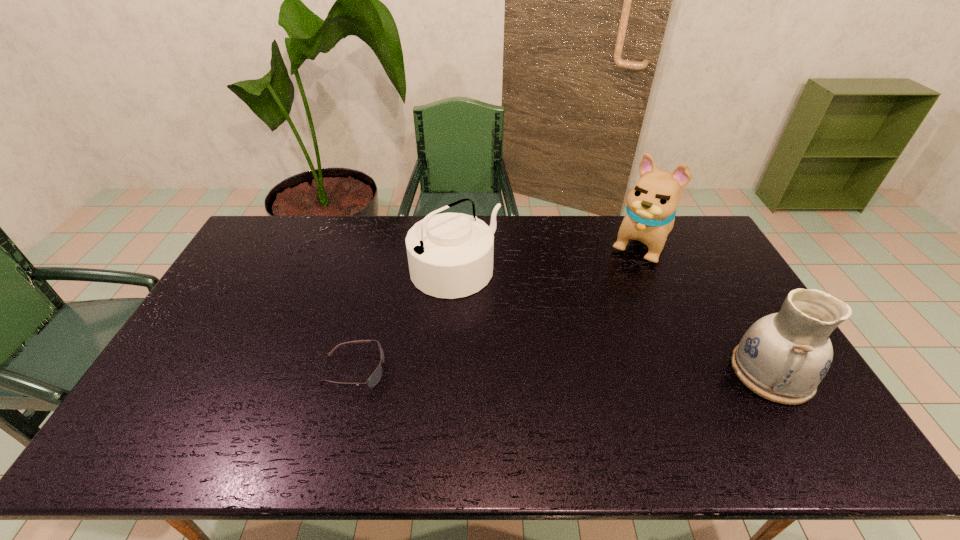
Locate an element on the screen. object that is at the near right corner is located at coordinates (782, 357).

The width and height of the screenshot is (960, 540). In the image, there is a desktop. What are the coordinates of `vacant space at the far edge` in the screenshot? It's located at (605, 230).

Find the location of a particular element. The height and width of the screenshot is (540, 960). free point at the left edge is located at coordinates (205, 306).

The image size is (960, 540). Identify the location of vacant space at the right edge. (685, 255).

Identify the location of free space at the far left corner of the desktop. This screenshot has height=540, width=960. (298, 228).

Where is `vacant space at the near right corner`? This screenshot has width=960, height=540. vacant space at the near right corner is located at coordinates (806, 410).

This screenshot has width=960, height=540. I want to click on vacant space that's between the tallest object and the kettle, so click(548, 256).

This screenshot has height=540, width=960. I want to click on free spot between the tallest object and the sunglasses, so click(497, 307).

You are a GUI agent. You are given a task and a screenshot of the screen. Output one action in this format:
    pyautogui.click(x=<x>, y=<y>)
    Task: Click on the free space between the shortest object and the pottery
    The height and width of the screenshot is (540, 960).
    Given the screenshot: What is the action you would take?
    pyautogui.click(x=563, y=372)

At what (x,y) coordinates should I click in order to perform the action: click on vacant space that's between the pottery and the sunglasses. Please return your answer as a coordinate pair (x, y). Looking at the image, I should click on (563, 372).